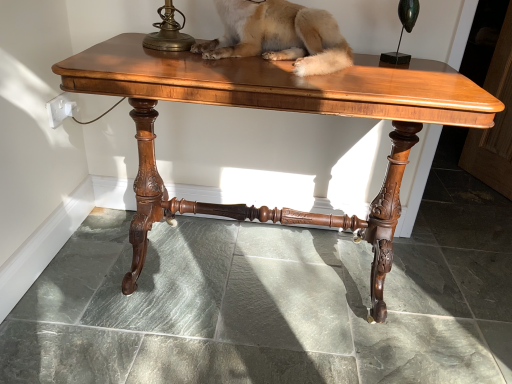
At what (x,y) coordinates should I click in order to perform the action: click on vacant space underneath shiny brown wood table at center (from a real-world perspective). Please return your answer as a coordinate pair (x, y). The height and width of the screenshot is (384, 512). Looking at the image, I should click on (258, 268).